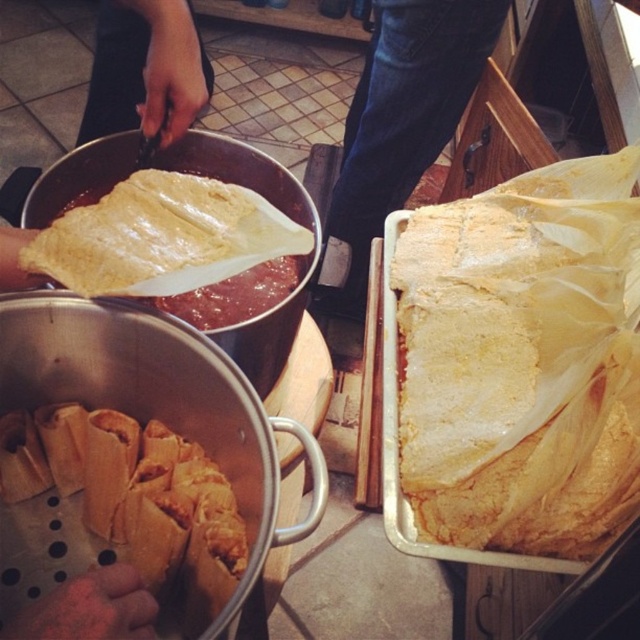
You are preparing to wrap a tamale and have both the yellow paper wrapper at center and the yellowish matte corn tortilla at upper left available. Which item should you use as the wrapper for the tamale filling?

The yellow paper wrapper at center is larger in size than the yellowish matte corn tortilla at upper left, so you should use the yellow paper wrapper at center as it can better contain the tamale filling.

You are preparing to wrap a tamale and see the yellow paper wrapper at center and the yellowish matte corn tortilla at upper left. Which item is located to the right of the other?

The yellow paper wrapper at center is positioned on the right side of yellowish matte corn tortilla at upper left.